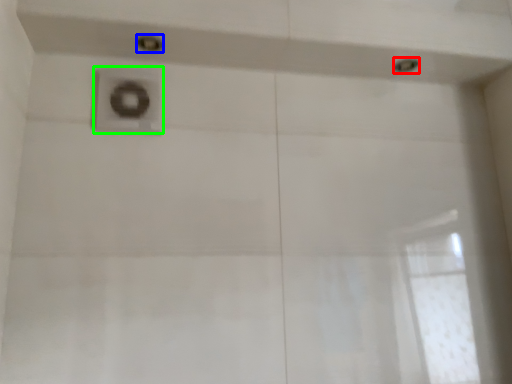
Question: Which object is positioned farthest from shower (highlighted by a red box)? Select from shower (highlighted by a blue box) and plumbing fixture (highlighted by a green box).

Choices:
 (A) shower
 (B) plumbing fixture

Answer: (B)